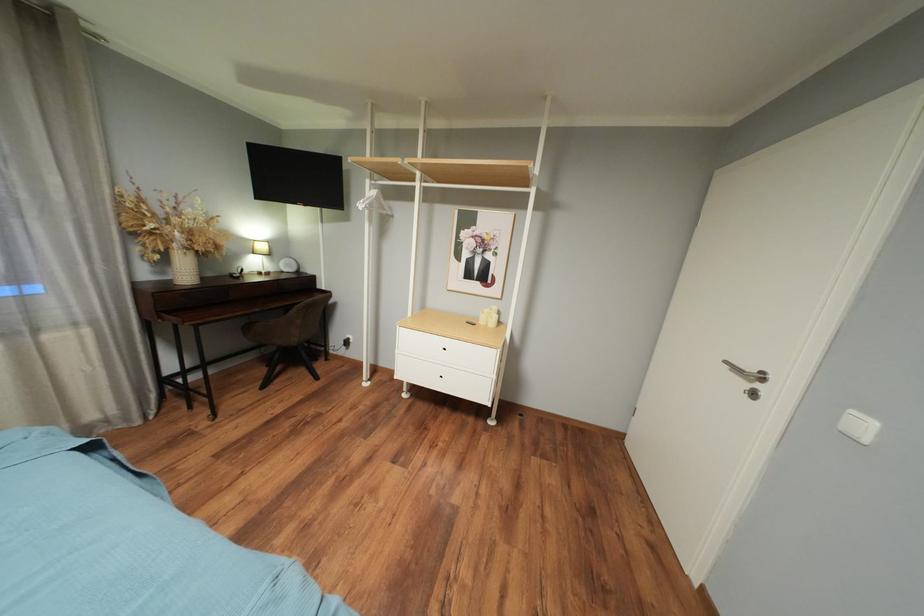
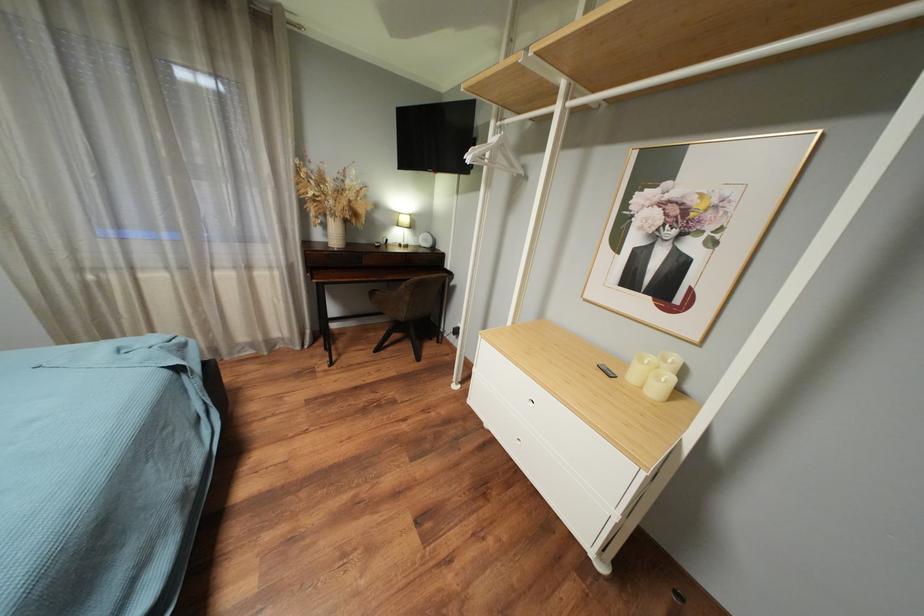
Question: Based on the continuous images, in which direction is the camera rotating? Reply with the corresponding letter.

Choices:
 (A) Left
 (B) Right
 (C) Up
 (D) Down

Answer: (A)